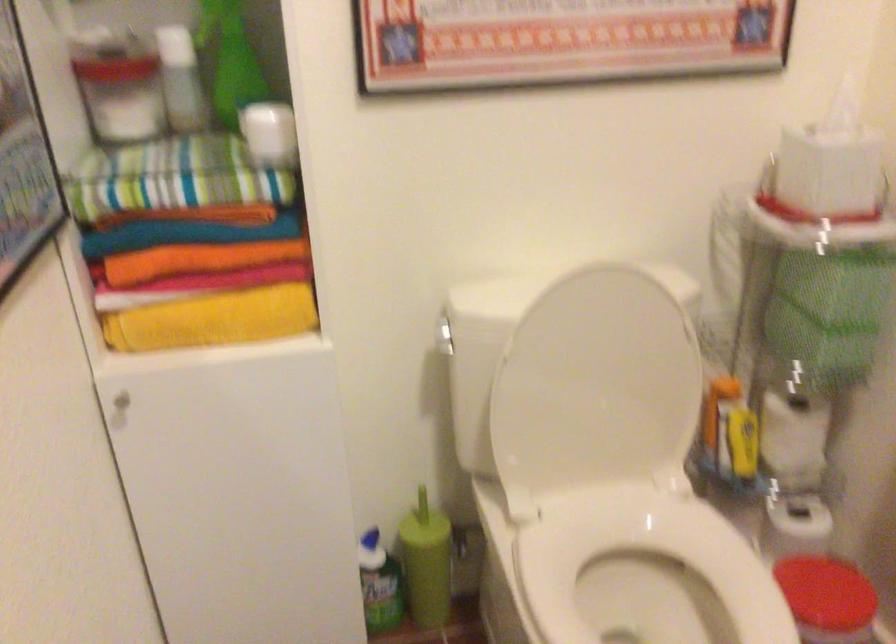
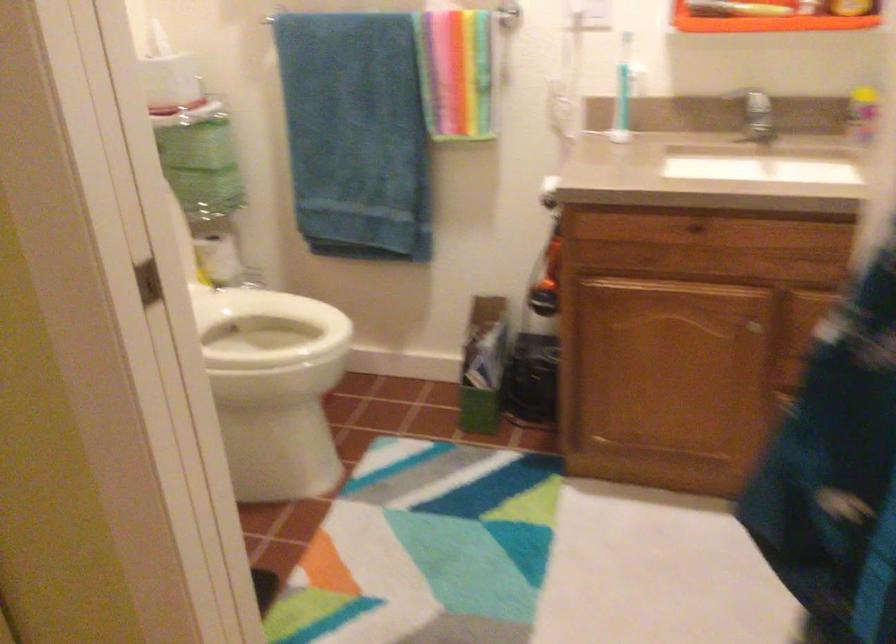
In the second image, find the point that corresponds to pixel 819 279 in the first image.

(196, 145)